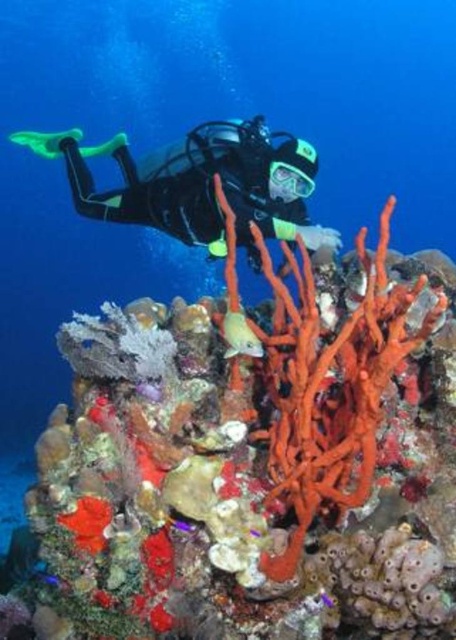
Between black matte scuba diver at upper center and blue glossy fish at lower left, which one has more height?

black matte scuba diver at upper center is taller.

Between point (176, 205) and point (50, 576), which one is positioned behind?

Positioned behind is point (176, 205).

At what (x,y) coordinates should I click in order to perform the action: click on black matte scuba diver at upper center. Please return your answer as a coordinate pair (x, y). Image resolution: width=456 pixels, height=640 pixels. Looking at the image, I should click on (201, 184).

Between orange sponge at center and black matte scuba diver at upper center, which one is positioned lower?

orange sponge at center is lower down.

Is orange sponge at center to the left of black matte scuba diver at upper center from the viewer's perspective?

Indeed, orange sponge at center is positioned on the left side of black matte scuba diver at upper center.

Between point (94, 400) and point (299, 227), which one is positioned behind?

The point (299, 227) is behind.

You are a GUI agent. You are given a task and a screenshot of the screen. Output one action in this format:
    pyautogui.click(x=<x>, y=<y>)
    Task: Click on the orange sponge at center
    This screenshot has height=640, width=456.
    Given the screenshot: What is the action you would take?
    pyautogui.click(x=253, y=464)

Does point (10, 609) lie behind point (34, 576)?

That is False.

Based on the photo, does orange sponge at center have a lesser height compared to blue glossy fish at lower left?

Incorrect, orange sponge at center's height does not fall short of blue glossy fish at lower left's.

What do you see at coordinates (253, 464) in the screenshot? This screenshot has width=456, height=640. I see `orange sponge at center` at bounding box center [253, 464].

Image resolution: width=456 pixels, height=640 pixels. I want to click on orange sponge at center, so click(x=253, y=464).